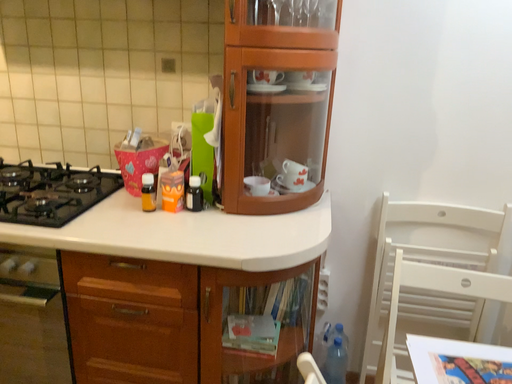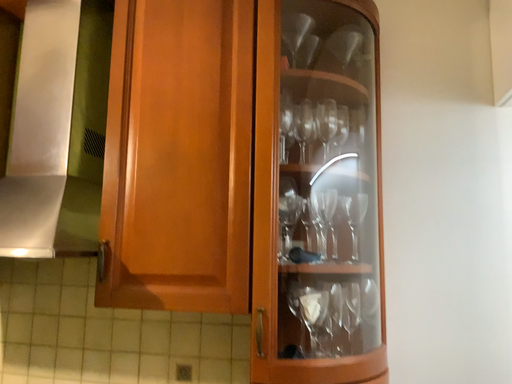
Question: Which way did the camera rotate in the video?

Choices:
 (A) rotated upward
 (B) rotated downward

Answer: (A)